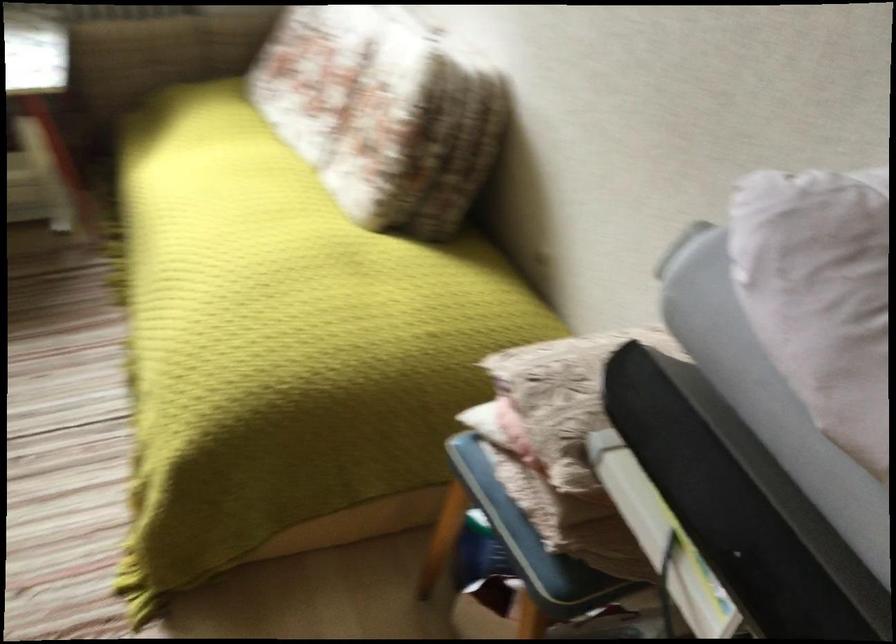
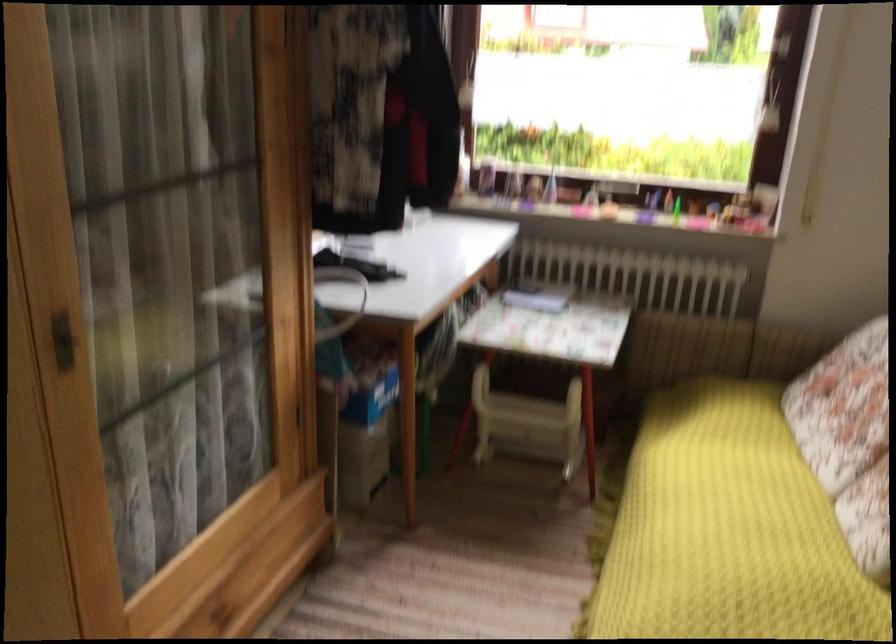
Locate, in the second image, the point that corresponds to point (227, 223) in the first image.

(728, 529)